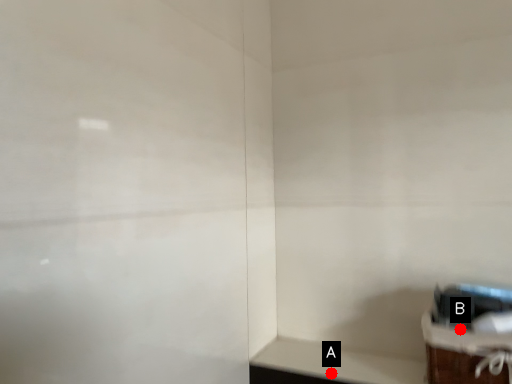
Question: Two points are circled on the image, labeled by A and B beside each circle. Which point is farther to the camera?

Choices:
 (A) A is further
 (B) B is further

Answer: (A)